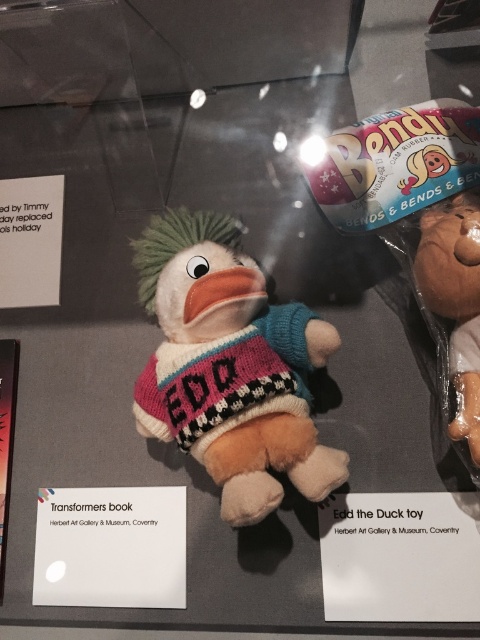
Question: Which of the following is the farthest from the observer?

Choices:
 (A) (236, 461)
 (B) (455, 436)

Answer: (A)

Question: Is fluffy multicolored duck at center in front of matte brown plush toy at right?

Choices:
 (A) yes
 (B) no

Answer: (A)

Question: Can you confirm if fluffy multicolored duck at center is positioned to the left of matte brown plush toy at right?

Choices:
 (A) no
 (B) yes

Answer: (B)

Question: Does fluffy multicolored duck at center have a lesser width compared to matte brown plush toy at right?

Choices:
 (A) yes
 (B) no

Answer: (B)

Question: Among these objects, which one is nearest to the camera?

Choices:
 (A) matte brown plush toy at right
 (B) fluffy multicolored duck at center

Answer: (B)

Question: Which point is farther to the camera?

Choices:
 (A) (455, 432)
 (B) (275, 368)

Answer: (B)